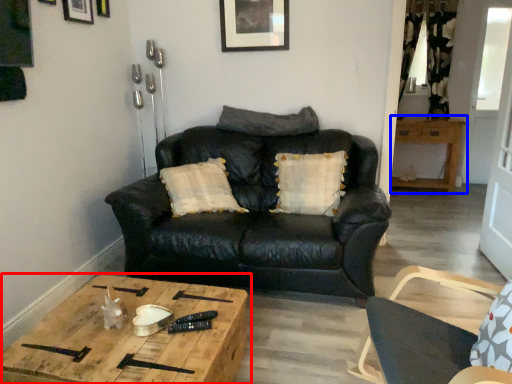
Question: Which of the following is the closest to the observer, table (highlighted by a red box) or table (highlighted by a blue box)?

Choices:
 (A) table
 (B) table

Answer: (A)